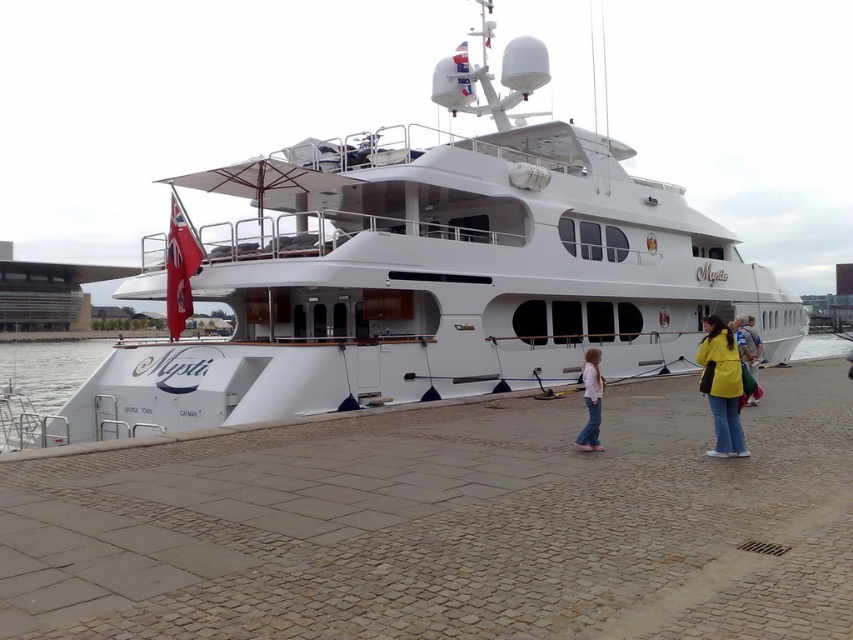
You are a guest on the yacht Mystic and want to store your belongings in a storage compartment located at the lower deck. You have both the yellow matte jacket at lower right and the yellow fabric bag at lower right. Which item would require more space in the storage compartment?

The yellow fabric bag at lower right requires more space in the storage compartment because it is larger than the yellow matte jacket at lower right.

You are a guest on the yacht Mystic and need to locate your belongings. You remember leaving a yellow matte jacket at lower right and a yellow fabric bag at lower right. Which item is positioned closer to the left side of the yacht?

The yellow matte jacket at lower right is positioned to the left of the yellow fabric bag at lower right, so the yellow matte jacket at lower right is closer to the left side of the yacht.

You are a photographer standing on the dock near the yellow matte jacket at lower right. You want to take a photo of the white glossy yacht at center. Considering the distance between them, is it possible to capture the entire yacht in a single frame without moving your position?

The distance between the white glossy yacht at center and the yellow matte jacket at lower right is 15.58 meters. Since the yacht is at a distance, it may be possible to capture the entire yacht in a single frame using a wide angle lens or by adjusting your camera settings appropriately. However, this depends on the camera equipment available and the zoom capabilities of your lens.